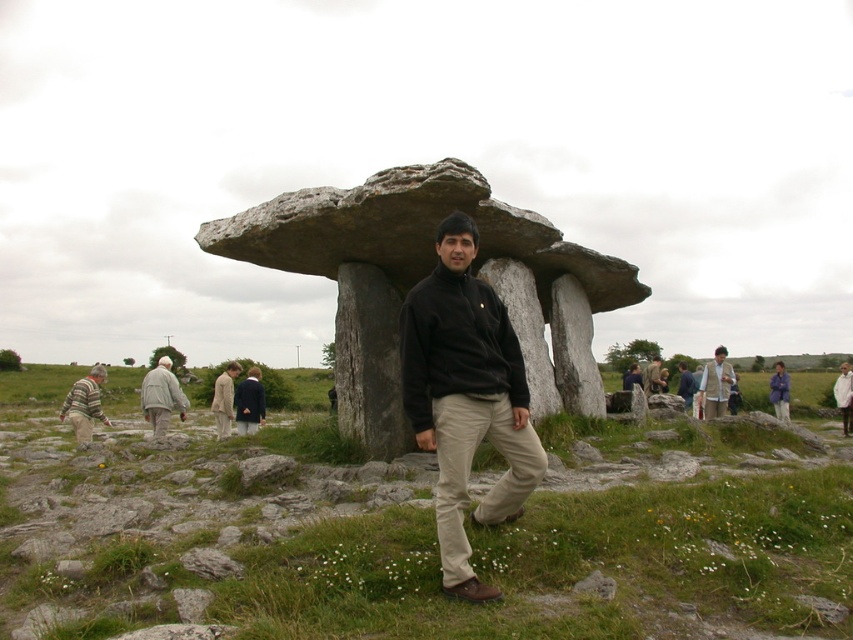
You are a photographer planning to take a wide shot of the rough stone structure at center and the dark blue jacket at center. Based on their sizes, which object should you prioritize framing first to ensure it fits in the frame?

The rough stone structure at center is wider than the dark blue jacket at center, so you should prioritize framing the rough stone structure at center first to ensure it fits in the frame.